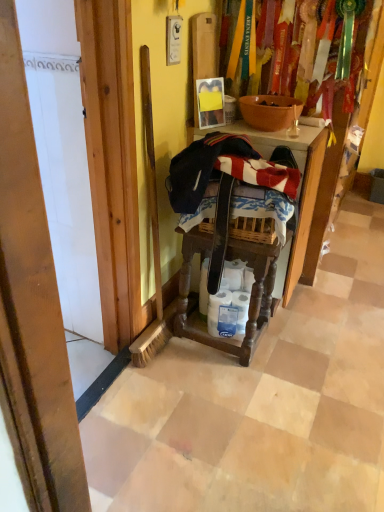
Question: Does wooden step stool at center have a smaller size compared to white matte toilet paper at center?

Choices:
 (A) yes
 (B) no

Answer: (B)

Question: Can you confirm if wooden step stool at center is shorter than white matte toilet paper at center?

Choices:
 (A) no
 (B) yes

Answer: (A)

Question: Is wooden step stool at center directly adjacent to white matte toilet paper at center?

Choices:
 (A) yes
 (B) no

Answer: (B)

Question: From a real-world perspective, does wooden step stool at center sit lower than white matte toilet paper at center?

Choices:
 (A) no
 (B) yes

Answer: (A)

Question: Could you tell me if wooden step stool at center is facing white matte toilet paper at center?

Choices:
 (A) yes
 (B) no

Answer: (B)

Question: Is wooden step stool at center bigger than white matte toilet paper at center?

Choices:
 (A) no
 (B) yes

Answer: (B)

Question: Is white matte toilet paper at center further to camera compared to matte orange bowl at center?

Choices:
 (A) yes
 (B) no

Answer: (A)

Question: Considering the relative positions of white matte toilet paper at center and matte orange bowl at center in the image provided, is white matte toilet paper at center to the left of matte orange bowl at center from the viewer's perspective?

Choices:
 (A) yes
 (B) no

Answer: (A)

Question: From a real-world perspective, is white matte toilet paper at center on matte orange bowl at center?

Choices:
 (A) no
 (B) yes

Answer: (A)

Question: Does white matte toilet paper at center come in front of matte orange bowl at center?

Choices:
 (A) no
 (B) yes

Answer: (A)

Question: Is white matte toilet paper at center smaller than matte orange bowl at center?

Choices:
 (A) no
 (B) yes

Answer: (B)

Question: Is white matte toilet paper at center aimed at matte orange bowl at center?

Choices:
 (A) no
 (B) yes

Answer: (A)

Question: Would you say matte orange bowl at center is outside white matte toilet paper at center?

Choices:
 (A) yes
 (B) no

Answer: (A)